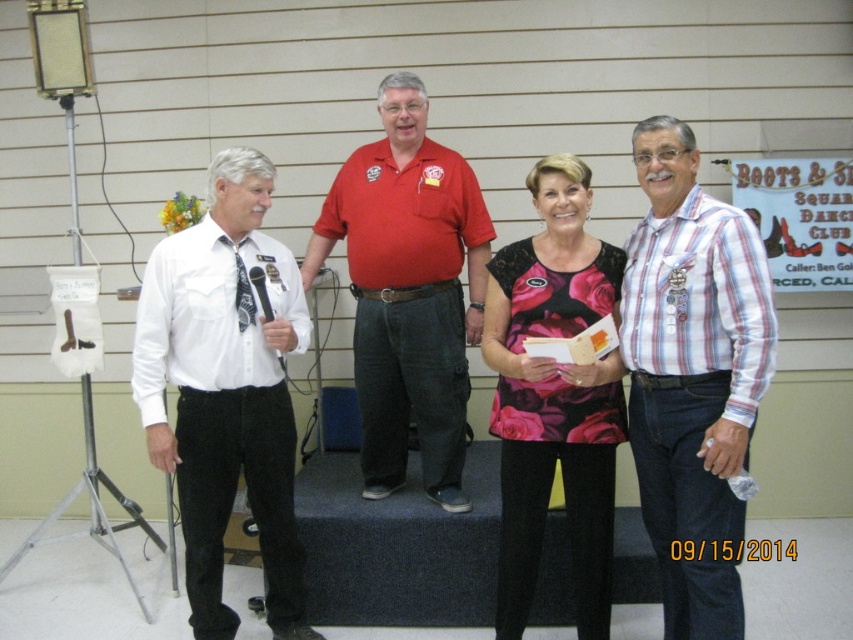
Question: Is striped cotton shirt at right smaller than white cotton shirt at left?

Choices:
 (A) no
 (B) yes

Answer: (B)

Question: Which is nearer to the floral-patterned fabric dress at center?

Choices:
 (A) striped cotton shirt at right
 (B) red cotton shirt at center
 (C) white cotton shirt at left

Answer: (A)

Question: Which point is farther to the camera?

Choices:
 (A) (653, 547)
 (B) (268, 490)

Answer: (B)

Question: Can you confirm if striped cotton shirt at right is positioned to the right of floral-patterned fabric dress at center?

Choices:
 (A) no
 (B) yes

Answer: (B)

Question: Which of the following is the closest to the observer?

Choices:
 (A) (715, 532)
 (B) (544, 484)
 (C) (209, 349)

Answer: (A)

Question: Considering the relative positions of white cotton shirt at left and red cotton shirt at center in the image provided, where is white cotton shirt at left located with respect to red cotton shirt at center?

Choices:
 (A) right
 (B) left

Answer: (B)